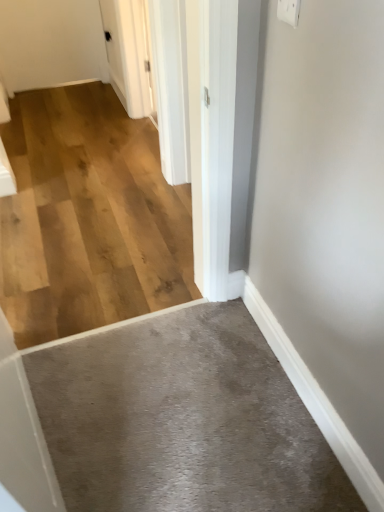
Question: Can you confirm if gray carpet at lower center, which appears as the 1th concrete when ordered from the bottom, is wider than white plastic electric outlet at upper right?

Choices:
 (A) no
 (B) yes

Answer: (B)

Question: Is gray carpet at lower center, which appears as the 1th concrete when ordered from the bottom, touching white plastic electric outlet at upper right?

Choices:
 (A) no
 (B) yes

Answer: (A)

Question: From the image's perspective, is gray carpet at lower center, which appears as the 1th concrete when ordered from the bottom, beneath white plastic electric outlet at upper right?

Choices:
 (A) yes
 (B) no

Answer: (A)

Question: Does gray carpet at lower center, which appears as the 1th concrete when ordered from the bottom, have a larger size compared to white plastic electric outlet at upper right?

Choices:
 (A) yes
 (B) no

Answer: (A)

Question: Is gray carpet at lower center, positioned as the 2th concrete in back-to-front order, surrounding white plastic electric outlet at upper right?

Choices:
 (A) no
 (B) yes

Answer: (A)

Question: Can you confirm if gray carpet at lower center, the first concrete when ordered from front to back, is positioned to the right of white plastic electric outlet at upper right?

Choices:
 (A) yes
 (B) no

Answer: (B)

Question: From the image's perspective, is natural wood flooring at center, positioned as the 2th concrete in front-to-back order, below white glossy door at upper center?

Choices:
 (A) yes
 (B) no

Answer: (A)

Question: Is natural wood flooring at center, positioned as the 2th concrete in front-to-back order, positioned before white glossy door at upper center?

Choices:
 (A) no
 (B) yes

Answer: (B)

Question: Can white glossy door at upper center be found inside natural wood flooring at center, the 2th concrete in the bottom-to-top sequence?

Choices:
 (A) yes
 (B) no

Answer: (B)

Question: Does natural wood flooring at center, which is counted as the first concrete, starting from the top, come behind white glossy door at upper center?

Choices:
 (A) yes
 (B) no

Answer: (B)

Question: Can you confirm if natural wood flooring at center, the first concrete from the back, is wider than white glossy door at upper center?

Choices:
 (A) yes
 (B) no

Answer: (A)

Question: Is natural wood flooring at center, which is counted as the first concrete, starting from the top, not close to white glossy door at upper center?

Choices:
 (A) no
 (B) yes

Answer: (A)

Question: Does gray carpet at lower center, the second concrete when ordered from top to bottom, come in front of white glossy door at upper center?

Choices:
 (A) yes
 (B) no

Answer: (A)